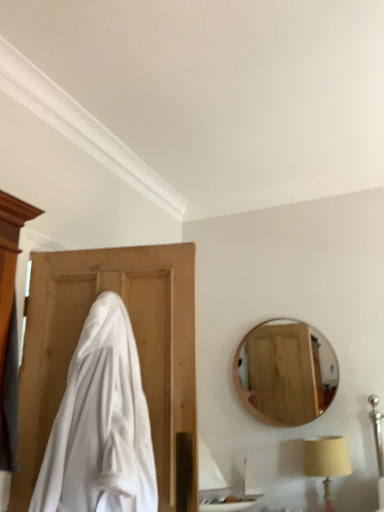
Question: Is point (334, 448) closer or farther from the camera than point (327, 353)?

Choices:
 (A) closer
 (B) farther

Answer: (A)

Question: Considering the positions of beige fabric lampshade at lower right and wooden mirror at upper right in the image, is beige fabric lampshade at lower right bigger or smaller than wooden mirror at upper right?

Choices:
 (A) small
 (B) big

Answer: (A)

Question: Based on their relative distances, which object is nearer to the beige fabric lampshade at lower right?

Choices:
 (A) wooden mirror at upper right
 (B) white glossy sink at lower center
 (C) white cloth at left

Answer: (A)

Question: Based on their relative distances, which object is nearer to the white cloth at left?

Choices:
 (A) wooden mirror at upper right
 (B) beige fabric lampshade at lower right
 (C) white glossy sink at lower center

Answer: (C)